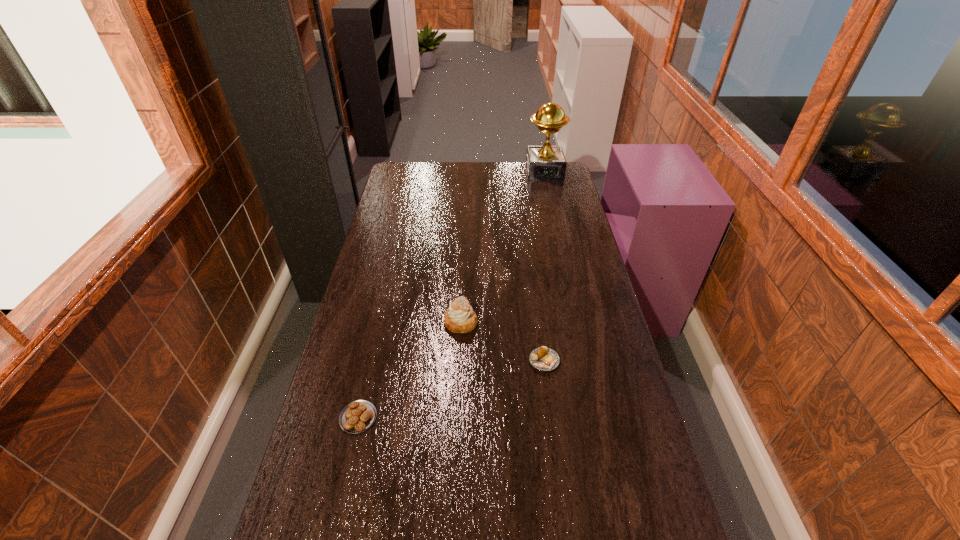
I want to click on free spot between the leftmost object and the second object from left to right, so click(x=410, y=370).

You are a GUI agent. You are given a task and a screenshot of the screen. Output one action in this format:
    pyautogui.click(x=<x>, y=<y>)
    Task: Click on the unoccupied position between the tallest object and the third tallest object
    The height and width of the screenshot is (540, 960).
    Given the screenshot: What is the action you would take?
    pyautogui.click(x=544, y=266)

This screenshot has width=960, height=540. Identify the location of vacant space in between the leftmost object and the third farthest object. (451, 389).

Locate an element on the screen. The height and width of the screenshot is (540, 960). free space that is in between the second shortest object and the shortest pastry is located at coordinates (451, 389).

Image resolution: width=960 pixels, height=540 pixels. Identify the location of unoccupied position between the second object from left to right and the shortest pastry. (410, 370).

In order to click on vacant space that is in between the second object from left to right and the leftmost object in this screenshot , I will do `click(410, 370)`.

Where is `empty location between the farthest pastry and the farthest object`? The width and height of the screenshot is (960, 540). empty location between the farthest pastry and the farthest object is located at coordinates (503, 247).

This screenshot has height=540, width=960. Find the location of `empty space that is in between the second farthest object and the shortest object`. empty space that is in between the second farthest object and the shortest object is located at coordinates (410, 370).

You are a GUI agent. You are given a task and a screenshot of the screen. Output one action in this format:
    pyautogui.click(x=<x>, y=<y>)
    Task: Click on the vacant area between the second shortest object and the shortest object
    
    Given the screenshot: What is the action you would take?
    pyautogui.click(x=451, y=389)

Locate an element on the screen. The height and width of the screenshot is (540, 960). free space that is in between the second nearest pastry and the farthest object is located at coordinates (544, 266).